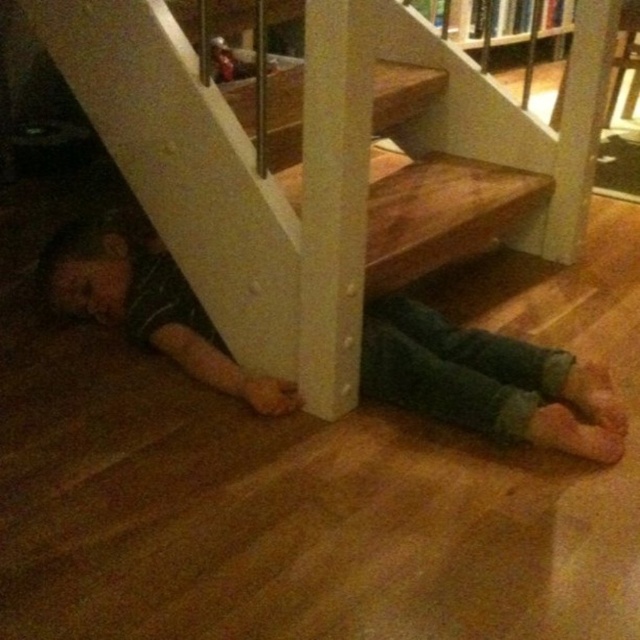
You are a delivery person trying to reach the front door, which is located to the right of the staircase. You see the wooden at lower left and the green denim pants at lower left in your path. Which object should you avoid stepping on to reach the door safely?

You should avoid stepping on the green denim pants at lower left because the wooden at lower left is to its right, meaning the pants are closer to the left side of your path. Stepping around the left side of the pants would allow you to move toward the right towards the door without obstruction.

You are standing at the top of the staircase in the image. You want to walk down to the person lying on the floor. Which point, point (378, 273) or point (49, 298), would you step on first as you descend?

Point (378, 273) is in front of point (49, 298), so you would step on point (378, 273) first as you descend the staircase.

You are a delivery person trying to reach the front door located at the top of the staircase. You see the wooden at lower left and the green denim pants at lower left. Which object is closer to you as you approach the staircase?

The wooden at lower left is closer to you because it is in front of the green denim pants at lower left, meaning the wooden object is nearer to your current position as you approach the staircase.